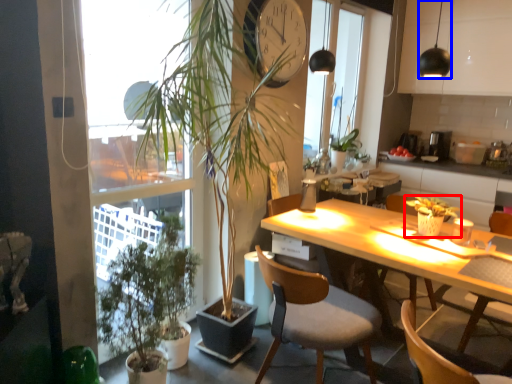
Question: Which object appears closest to the camera in this image, houseplant (highlighted by a red box) or lamp (highlighted by a blue box)?

Choices:
 (A) houseplant
 (B) lamp

Answer: (B)